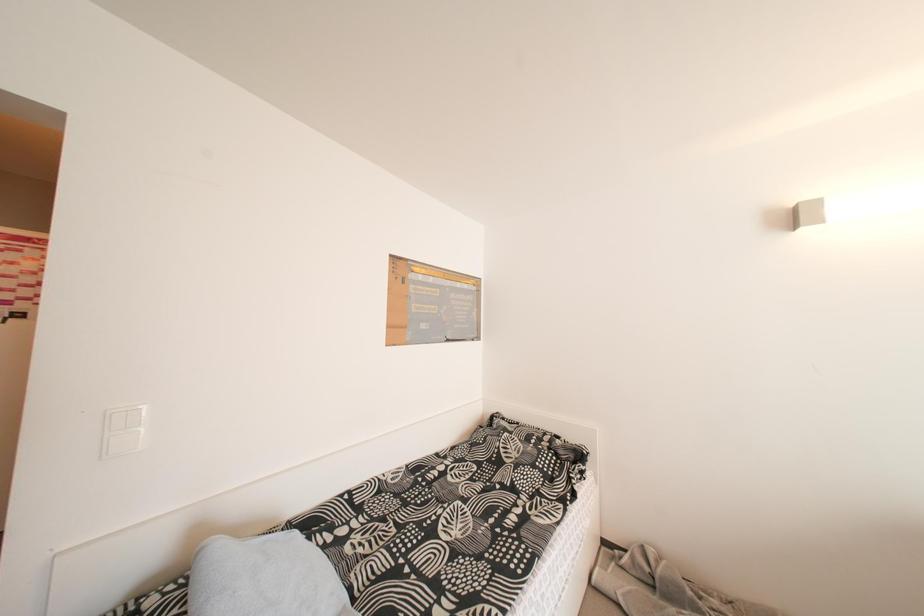
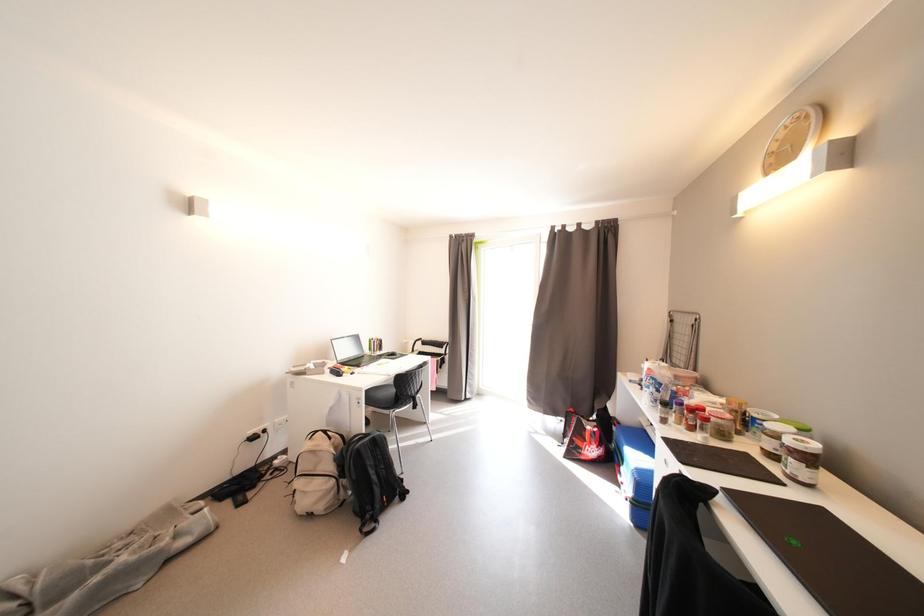
Question: The camera is either moving clockwise (left) or counter-clockwise (right) around the object. The first image is from the beginning of the video and the second image is from the end. Is the camera moving left or right when shooting the video?

Choices:
 (A) Left
 (B) Right

Answer: (A)